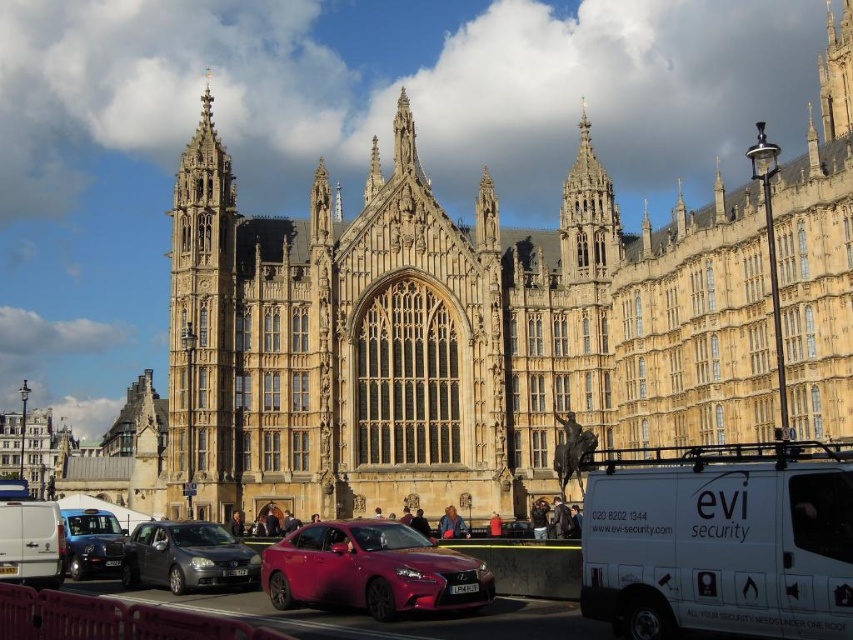
Is point (846, 45) farther from camera compared to point (7, 566)?

That is True.

How much distance is there between golden stone palace at center and white matte van at lower left?

The distance of golden stone palace at center from white matte van at lower left is 40.15 meters.

Between point (315, 404) and point (27, 538), which one is positioned behind?

Point (315, 404)

The height and width of the screenshot is (640, 853). What are the coordinates of `golden stone palace at center` in the screenshot? It's located at (495, 326).

Can you confirm if shiny red sedan at center is positioned below metallic blue taxi at lower left?

Actually, shiny red sedan at center is above metallic blue taxi at lower left.

This screenshot has width=853, height=640. Find the location of `shiny red sedan at center`. shiny red sedan at center is located at coordinates (370, 570).

Is golden stone tower at left above metallic gray sedan at lower left?

Correct, golden stone tower at left is located above metallic gray sedan at lower left.

Can you confirm if golden stone tower at left is thinner than metallic gray sedan at lower left?

In fact, golden stone tower at left might be wider than metallic gray sedan at lower left.

Measure the distance between point (181,333) and camera.

74.87 meters

This screenshot has width=853, height=640. Identify the location of golden stone tower at left. (202, 332).